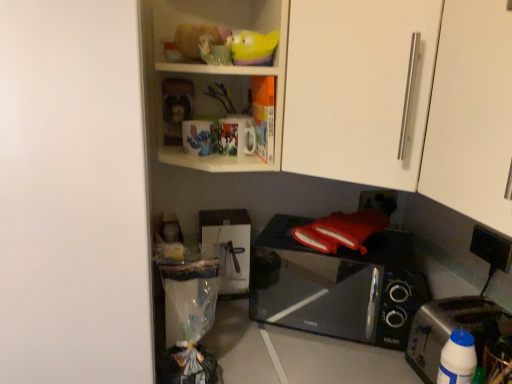
Question: Does black plastic electric outlet at lower right have a larger size compared to silver metallic toaster at lower right?

Choices:
 (A) yes
 (B) no

Answer: (B)

Question: From a real-world perspective, is black plastic electric outlet at lower right below silver metallic toaster at lower right?

Choices:
 (A) no
 (B) yes

Answer: (A)

Question: Is black plastic electric outlet at lower right touching silver metallic toaster at lower right?

Choices:
 (A) yes
 (B) no

Answer: (B)

Question: Does black plastic electric outlet at lower right have a smaller size compared to silver metallic toaster at lower right?

Choices:
 (A) no
 (B) yes

Answer: (B)

Question: From the image's perspective, would you say black plastic electric outlet at lower right is shown under silver metallic toaster at lower right?

Choices:
 (A) no
 (B) yes

Answer: (A)

Question: Considering the positions of point (219, 77) and point (346, 152), is point (219, 77) closer or farther from the camera than point (346, 152)?

Choices:
 (A) closer
 (B) farther

Answer: (B)

Question: Visually, is matte plastic shelf at upper center positioned to the left or to the right of white matte cabinet door at upper right, which is counted as the first cabinetry, starting from the back?

Choices:
 (A) right
 (B) left

Answer: (B)

Question: Is matte plastic shelf at upper center spatially inside white matte cabinet door at upper right, the second cabinetry when ordered from front to back, or outside of it?

Choices:
 (A) inside
 (B) outside

Answer: (B)

Question: From a real-world perspective, is matte plastic shelf at upper center above or below white matte cabinet door at upper right, the second cabinetry when ordered from front to back?

Choices:
 (A) above
 (B) below

Answer: (B)

Question: From their relative heights in the image, would you say yellow rubber duck at upper center is taller or shorter than black glossy microwave oven at lower right?

Choices:
 (A) tall
 (B) short

Answer: (B)

Question: Is yellow rubber duck at upper center bigger or smaller than black glossy microwave oven at lower right?

Choices:
 (A) small
 (B) big

Answer: (A)

Question: Choose the correct answer: Is yellow rubber duck at upper center inside black glossy microwave oven at lower right or outside it?

Choices:
 (A) outside
 (B) inside

Answer: (A)

Question: Is yellow rubber duck at upper center wider or thinner than black glossy microwave oven at lower right?

Choices:
 (A) wide
 (B) thin

Answer: (B)

Question: Is black plastic electric outlet at lower right taller or shorter than matte plastic shelf at upper center?

Choices:
 (A) short
 (B) tall

Answer: (A)

Question: Visually, is black plastic electric outlet at lower right positioned to the left or to the right of matte plastic shelf at upper center?

Choices:
 (A) right
 (B) left

Answer: (A)